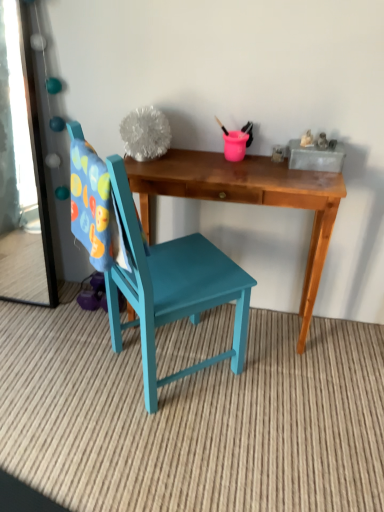
The height and width of the screenshot is (512, 384). I want to click on free space in front of teal painted wood chair at center, so click(165, 451).